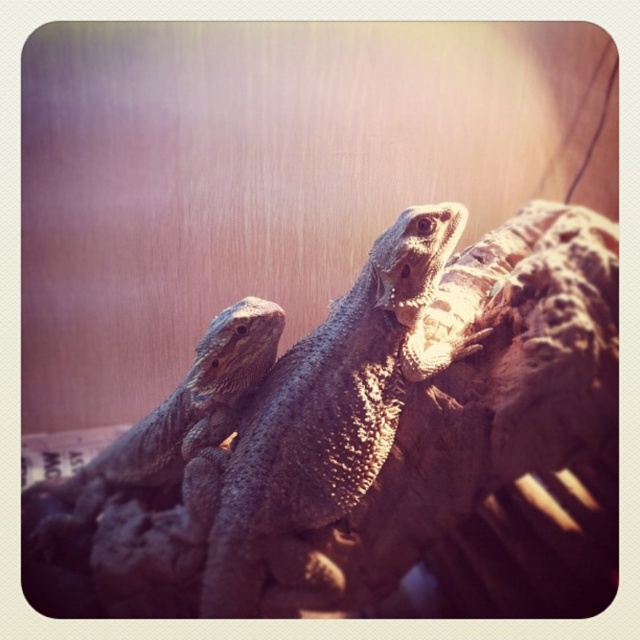
Question: Which object appears closest to the camera in this image?

Choices:
 (A) sandy brown scaly lizard at left
 (B) sandy brown scaly lizard at center

Answer: (B)

Question: Where is sandy brown scaly lizard at center located in relation to sandy brown scaly lizard at left in the image?

Choices:
 (A) right
 (B) left

Answer: (A)

Question: From the image, what is the correct spatial relationship of sandy brown scaly lizard at center in relation to sandy brown scaly lizard at left?

Choices:
 (A) above
 (B) below

Answer: (A)

Question: Is sandy brown scaly lizard at center in front of sandy brown scaly lizard at left?

Choices:
 (A) no
 (B) yes

Answer: (B)

Question: Which of the following is the farthest from the observer?

Choices:
 (A) (40, 529)
 (B) (248, 593)

Answer: (A)